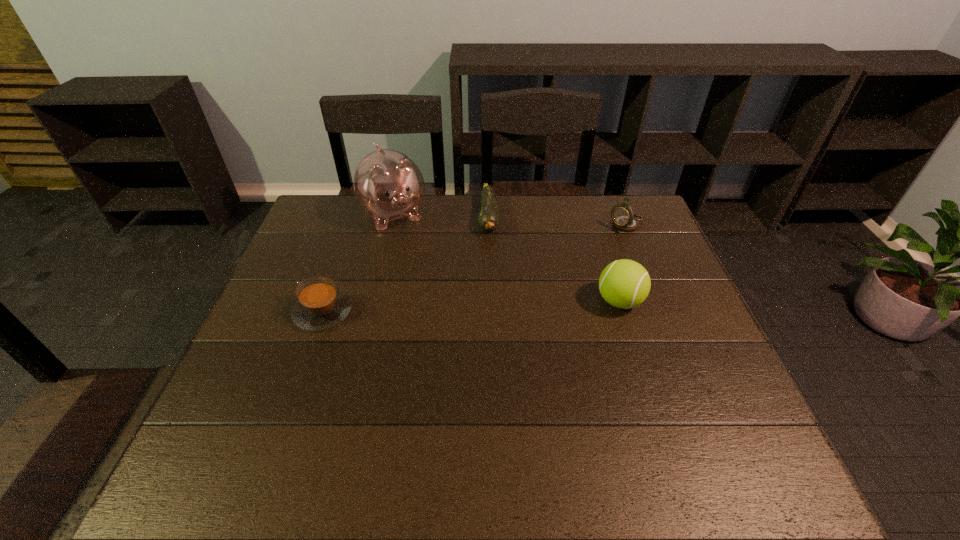
I want to click on free space on the desktop that is between the cappuccino and the tennis ball and is positioned on the face of the compass, so click(502, 305).

The height and width of the screenshot is (540, 960). What are the coordinates of `free space on the desktop that is between the fourth tallest object and the tennis ball and is positioned at the blossom end of the third object from left to right` in the screenshot? It's located at (482, 306).

Locate an element on the screen. This screenshot has width=960, height=540. vacant space on the desktop that is between the second shortest object and the tennis ball and is positioned on the front facing side of the tallest object is located at coordinates (444, 307).